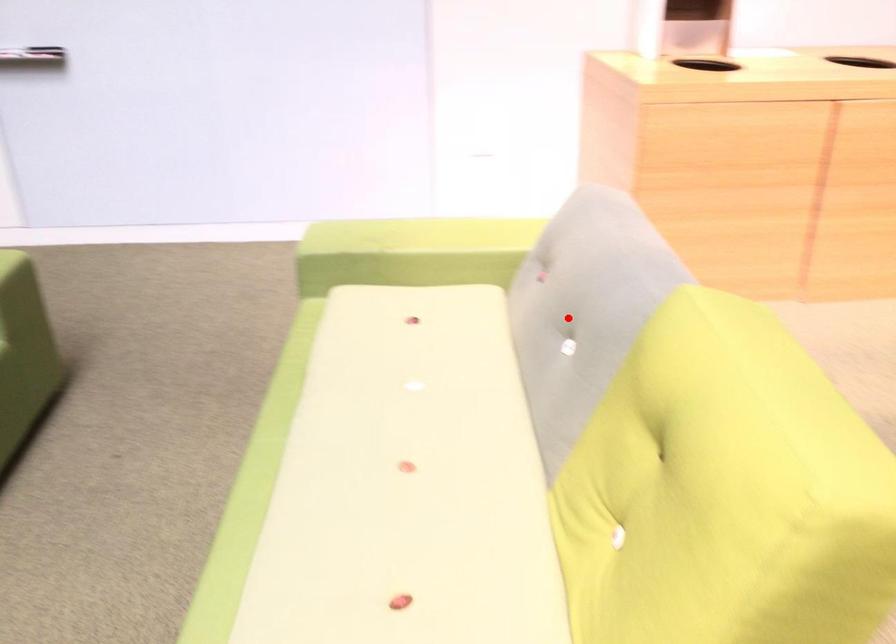
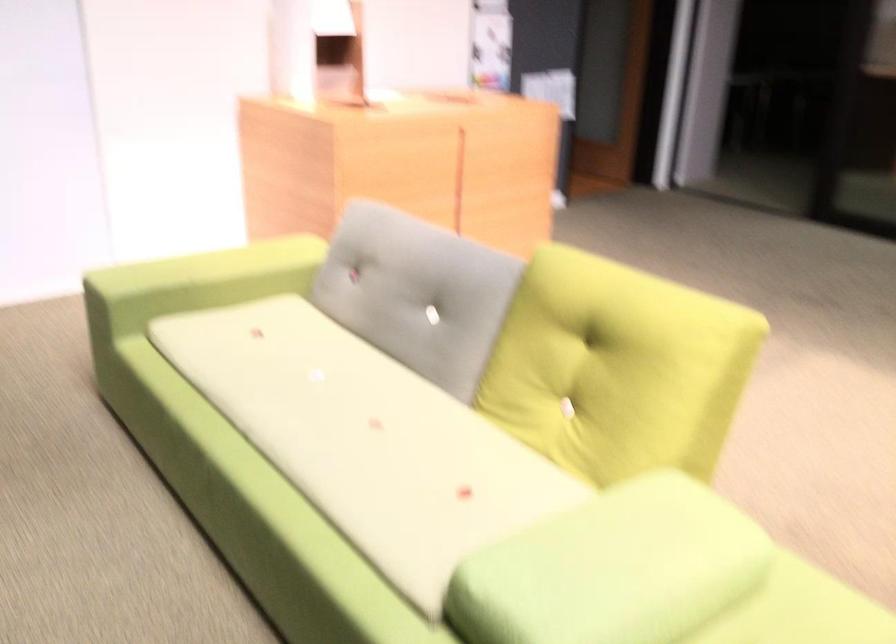
Find the pixel in the second image that matches the highlighted location in the first image.

(417, 292)